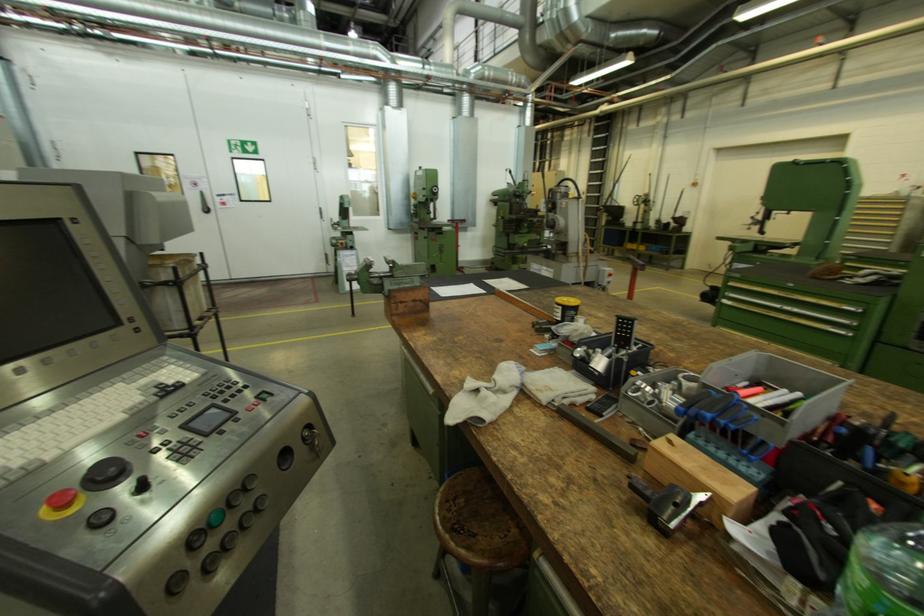
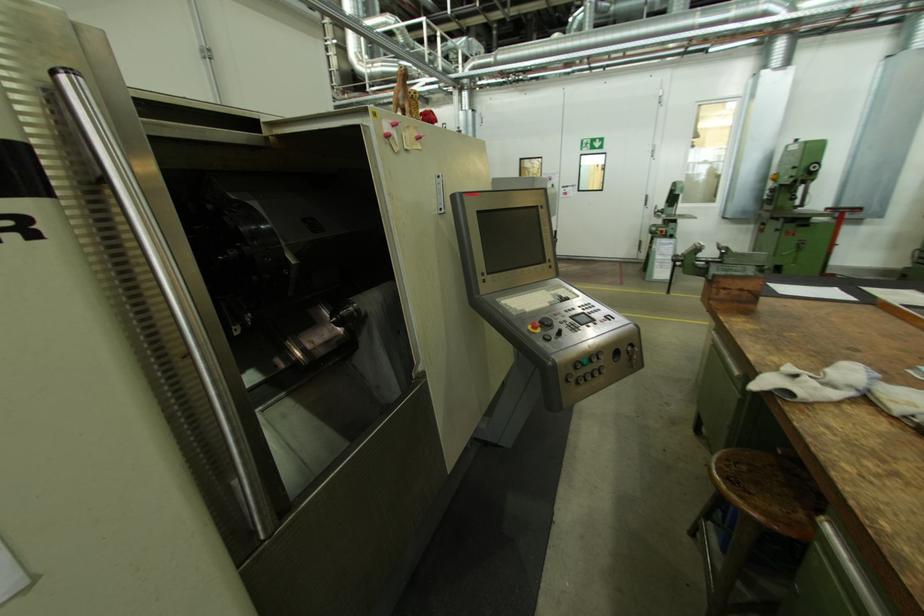
In the second image, find the point that corresponds to pixel 305 451 in the first image.

(629, 357)